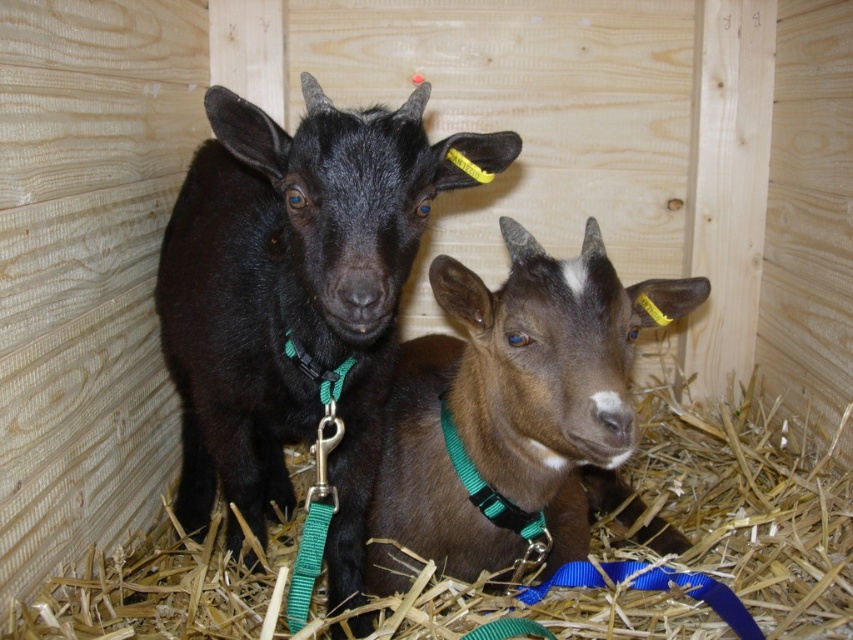
Does brown matte goat at center have a lesser height compared to green nylon collar at center?

Incorrect, brown matte goat at center's height does not fall short of green nylon collar at center's.

Which is behind, point (502, 368) or point (485, 481)?

Point (485, 481)

Find the location of a particular element. This screenshot has height=640, width=853. brown matte goat at center is located at coordinates (517, 406).

Is black matte goat at center behind green nylon collar at center?

No, it is not.

Which is behind, point (177, 374) or point (485, 490)?

Point (177, 374)

Is point (178, 508) positioned before point (445, 408)?

No.

This screenshot has width=853, height=640. Find the location of `black matte goat at center`. black matte goat at center is located at coordinates (296, 298).

Does brown straw at center come behind green nylon collar at center?

No.

Is brown straw at center above green nylon collar at center?

No.

This screenshot has width=853, height=640. In order to click on brown straw at center in this screenshot , I will do `click(753, 508)`.

The image size is (853, 640). Identify the location of brown straw at center. (753, 508).